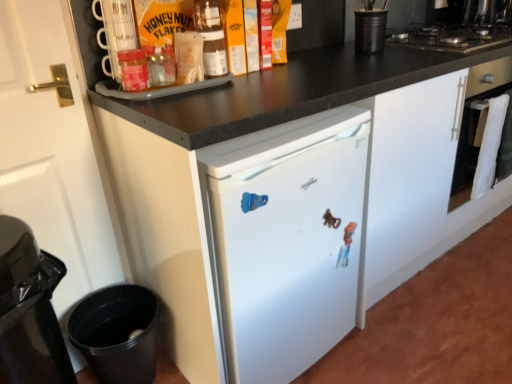
Question: Based on their positions, is black matte gas stove at upper right located to the left or right of black matte cup at upper right, which ranks as the first appliance in right-to-left order?

Choices:
 (A) right
 (B) left

Answer: (A)

Question: Considering the positions of black matte gas stove at upper right and black matte cup at upper right, which ranks as the first appliance in right-to-left order, in the image, is black matte gas stove at upper right wider or thinner than black matte cup at upper right, which ranks as the first appliance in right-to-left order,?

Choices:
 (A) wide
 (B) thin

Answer: (A)

Question: Estimate the real-world distances between objects in this image. Which object is farther from the black matte gas stove at upper right?

Choices:
 (A) plastic toy at center
 (B) matte glass jar at upper left, the first bottle positioned from the left
 (C) white matte door at left
 (D) white glossy oven at right
 (E) matte glass honey jar at upper center, which appears as the 2th bottle when viewed from the front

Answer: (C)

Question: Estimate the real-world distances between objects in this image. Which object is farther from the matte glass jar at upper left, placed as the 1th bottle when sorted from front to back?

Choices:
 (A) matte glass honey jar at upper center, which appears as the 2th bottle when viewed from the front
 (B) black matte gas stove at upper right
 (C) black glossy trash can at lower left
 (D) black matte cup at upper right, the first appliance from the top
 (E) white matte door at left

Answer: (B)